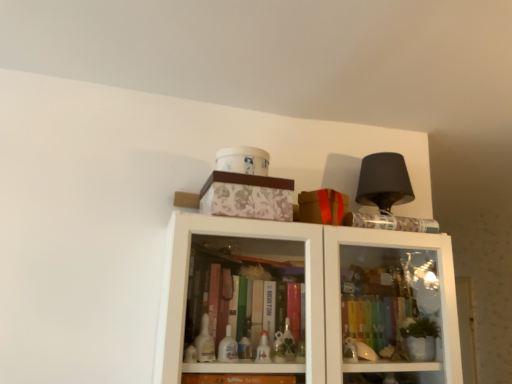
Find the location of `metallic silver book at upper right`. metallic silver book at upper right is located at coordinates (391, 222).

The width and height of the screenshot is (512, 384). Describe the element at coordinates (391, 222) in the screenshot. I see `metallic silver book at upper right` at that location.

Where is `metallic silver book at upper right`? The image size is (512, 384). metallic silver book at upper right is located at coordinates pos(391,222).